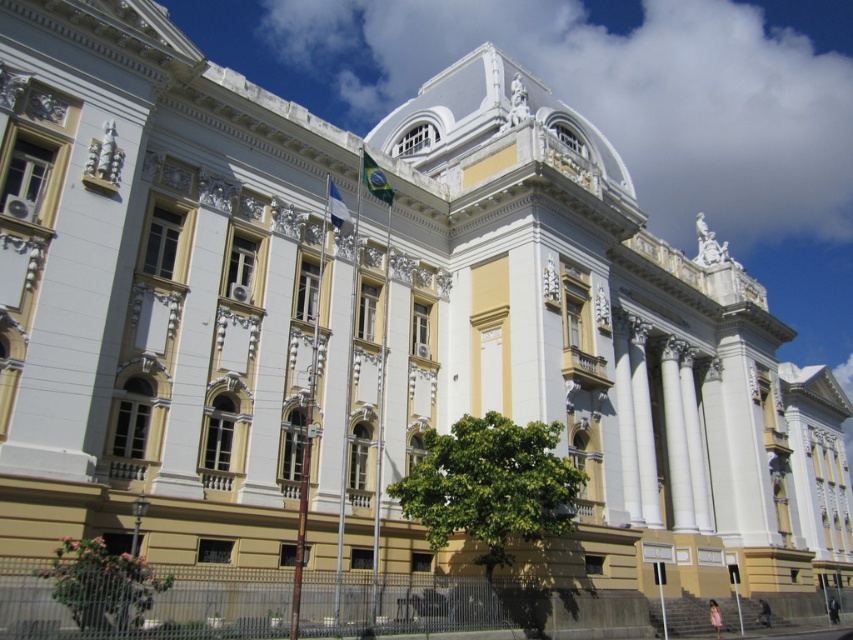
Question: Which point is closer to the camera?

Choices:
 (A) green leafy tree at lower left
 (B) green leafy tree at center

Answer: (A)

Question: Which of the following is the farthest from the observer?

Choices:
 (A) pyautogui.click(x=144, y=611)
 (B) pyautogui.click(x=548, y=470)

Answer: (B)

Question: Can you confirm if green leafy tree at center is positioned below green leafy tree at lower left?

Choices:
 (A) no
 (B) yes

Answer: (A)

Question: Is green leafy tree at center behind green leafy tree at lower left?

Choices:
 (A) no
 (B) yes

Answer: (B)

Question: Is green leafy tree at center positioned at the back of green leafy tree at lower left?

Choices:
 (A) yes
 (B) no

Answer: (A)

Question: Which point appears farthest from the camera in this image?

Choices:
 (A) (78, 554)
 (B) (467, 528)

Answer: (B)